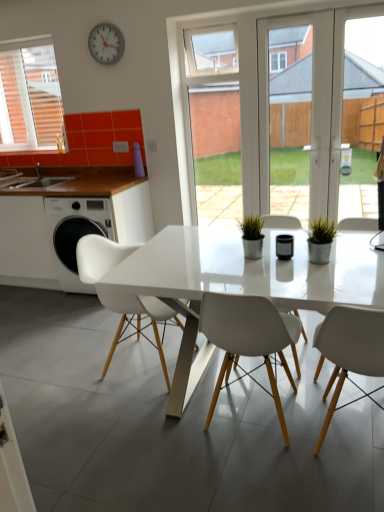
Identify the location of vacant space to the left of green matte plant at right. (274, 268).